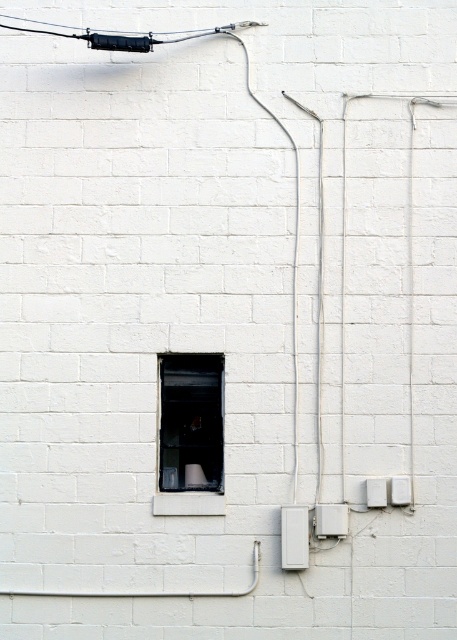
Does transparent glass window at center have a smaller size compared to white plastic electric outlet at lower right?

Actually, transparent glass window at center might be larger than white plastic electric outlet at lower right.

What do you see at coordinates (191, 435) in the screenshot? I see `transparent glass window at center` at bounding box center [191, 435].

Who is more distant from viewer, (218, 412) or (398, 496)?

Point (218, 412)

Find the location of a particular element. transparent glass window at center is located at coordinates (191, 435).